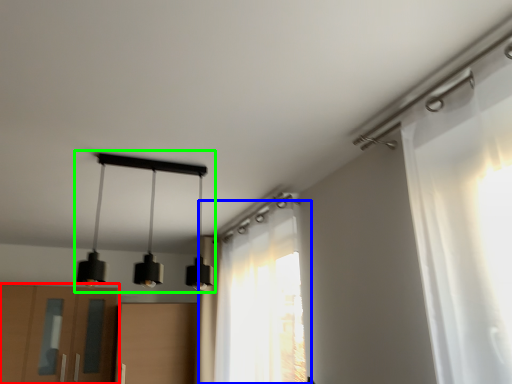
Question: Which object is the closest to the cabinetry (highlighted by a red box)? Choose among these: curtain (highlighted by a blue box) or lamp (highlighted by a green box).

Choices:
 (A) curtain
 (B) lamp

Answer: (B)